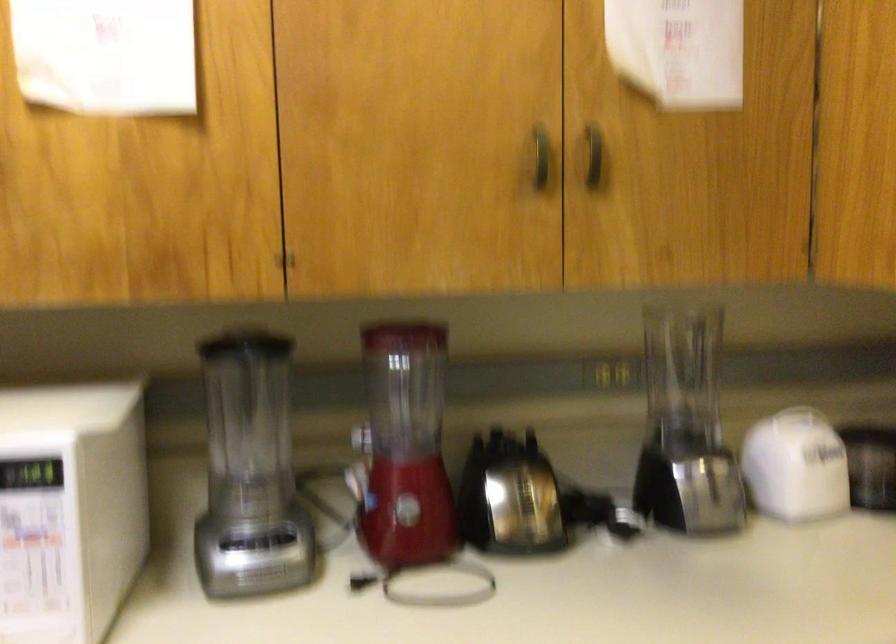
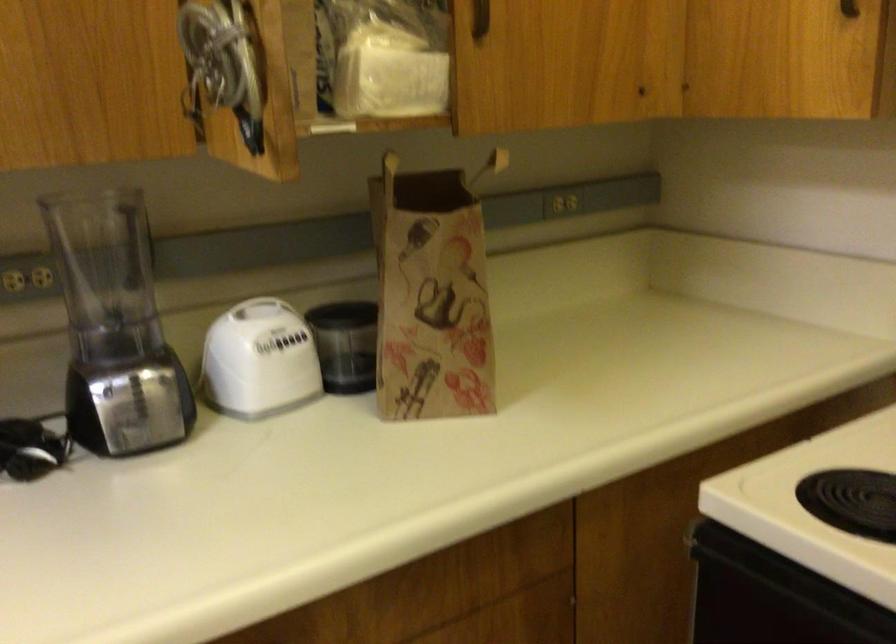
Find the pixel in the second image that matches (x=695, y=420) in the first image.

(115, 327)